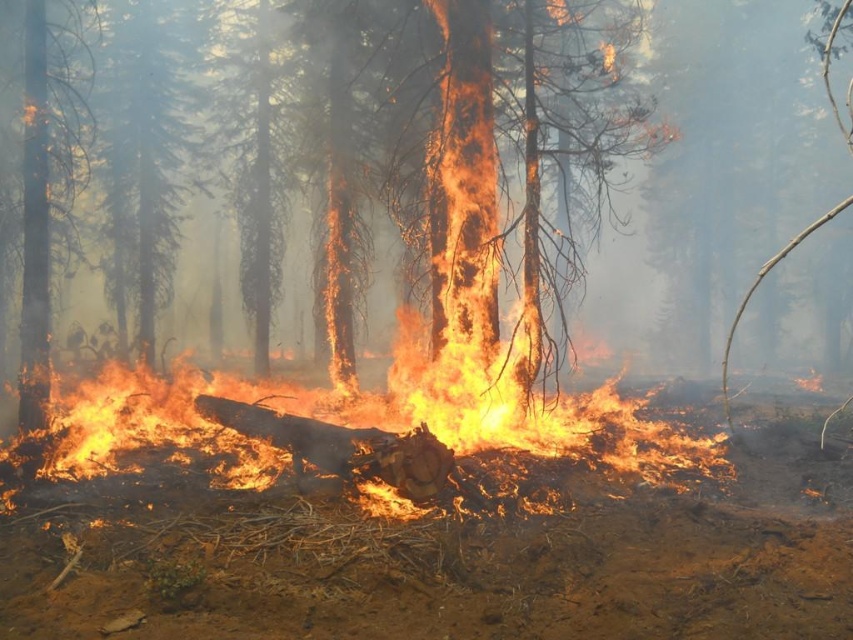
You are a firefighter assessing the fire spread. You see the charred wood trunk at center and the smooth bark tree at upper left. Which object is closer to you, the firefighter?

The charred wood trunk at center is closer to you because it is in front of the smooth bark tree at upper left.